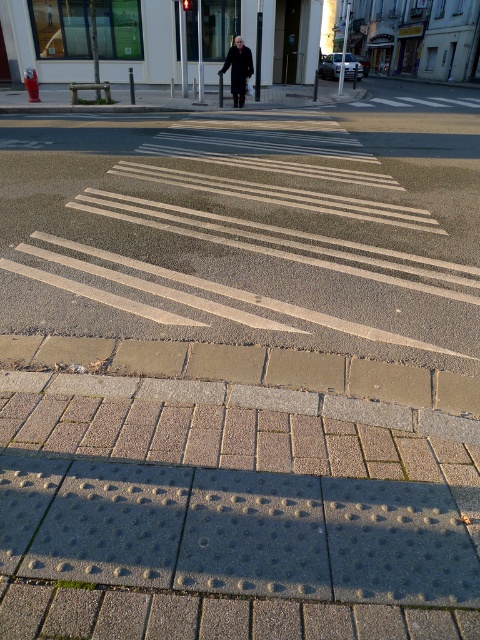
Question: Which is farther from the white painted lines at center?

Choices:
 (A) dark gray wool coat at center
 (B) brick textured pavement at lower center

Answer: (A)

Question: Can you confirm if brick textured pavement at lower center is bigger than dark gray wool coat at center?

Choices:
 (A) yes
 (B) no

Answer: (B)

Question: Is brick textured pavement at lower center below dark gray wool coat at center?

Choices:
 (A) yes
 (B) no

Answer: (A)

Question: Which of the following is the farthest from the observer?

Choices:
 (A) (251, 65)
 (B) (2, 456)

Answer: (A)

Question: Which is farther from the brick textured pavement at lower center?

Choices:
 (A) dark gray wool coat at center
 (B) white painted lines at center

Answer: (A)

Question: Does white painted lines at center have a lesser width compared to dark gray wool coat at center?

Choices:
 (A) no
 (B) yes

Answer: (A)